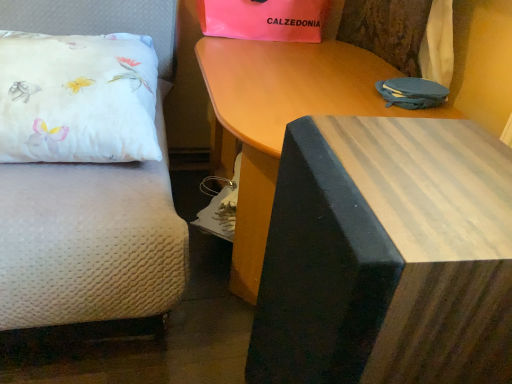
Question: In terms of size, does pink matte gift bag at upper center appear bigger or smaller than white satin pillow at left?

Choices:
 (A) small
 (B) big

Answer: (A)

Question: From the image's perspective, is pink matte gift bag at upper center positioned above or below white satin pillow at left?

Choices:
 (A) below
 (B) above

Answer: (B)

Question: Which is farther from the white satin pillow at left?

Choices:
 (A) pink matte gift bag at upper center
 (B) wooden table at center, the 1th table in the front-to-back sequence
 (C) wooden table at upper center, which is the 2th table from front to back

Answer: (B)

Question: Based on their relative distances, which object is nearer to the wooden table at upper center, marked as the first table in a back-to-front arrangement?

Choices:
 (A) wooden table at center, the second table viewed from the back
 (B) pink matte gift bag at upper center
 (C) white satin pillow at left

Answer: (B)